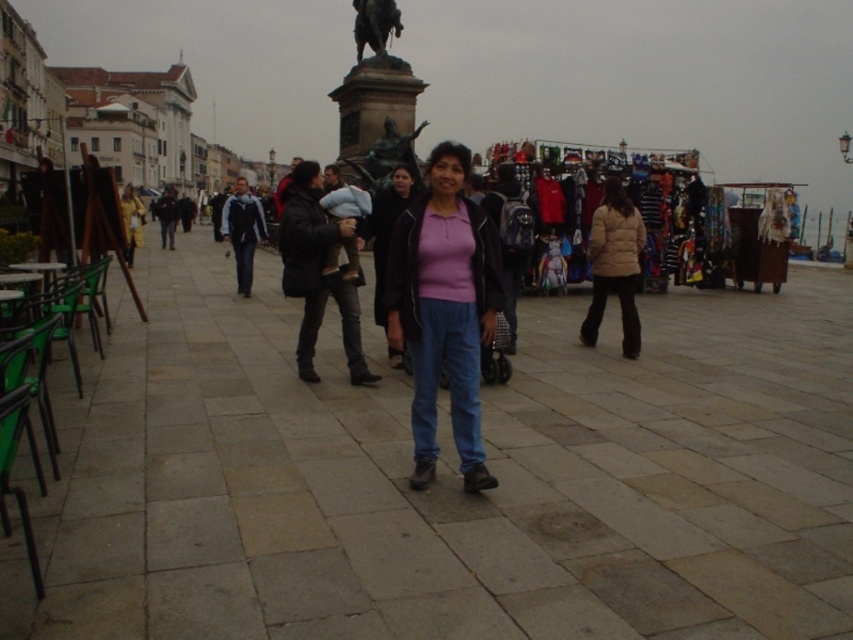
Question: Estimate the real-world distances between objects in this image. Which object is closer to the matte pink sweater at center?

Choices:
 (A) beige puffy jacket at right
 (B) bronze statue at center

Answer: (A)

Question: Among these objects, which one is farthest from the camera?

Choices:
 (A) matte pink sweater at center
 (B) bronze statue at center
 (C) beige puffy jacket at right

Answer: (B)

Question: Observing the image, what is the correct spatial positioning of matte pink sweater at center in reference to beige puffy jacket at right?

Choices:
 (A) above
 (B) below

Answer: (A)

Question: Is matte pink sweater at center smaller than beige puffy jacket at right?

Choices:
 (A) no
 (B) yes

Answer: (A)

Question: Does matte pink sweater at center appear on the left side of beige puffy jacket at right?

Choices:
 (A) yes
 (B) no

Answer: (A)

Question: Which point is closer to the camera taking this photo?

Choices:
 (A) (589, 308)
 (B) (369, 32)
 (C) (424, 465)

Answer: (C)